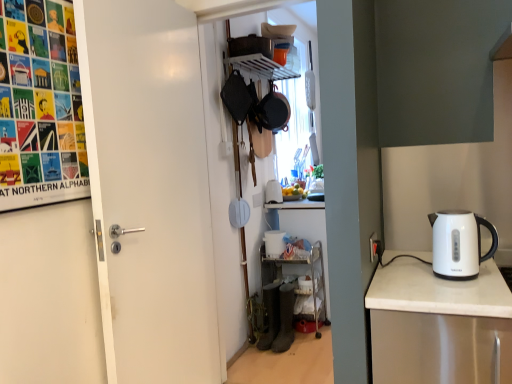
Question: Is white plastic shelf at upper center, marked as the second shelf in a bottom-to-top arrangement, at the left side of matte black frying pan at upper center?

Choices:
 (A) yes
 (B) no

Answer: (A)

Question: Considering the relative sizes of white plastic shelf at upper center, marked as the second shelf in a bottom-to-top arrangement, and matte black frying pan at upper center in the image provided, is white plastic shelf at upper center, marked as the second shelf in a bottom-to-top arrangement, shorter than matte black frying pan at upper center?

Choices:
 (A) yes
 (B) no

Answer: (A)

Question: Is the depth of white plastic shelf at upper center, the 1th shelf from the top, greater than that of matte black frying pan at upper center?

Choices:
 (A) no
 (B) yes

Answer: (A)

Question: Is white plastic shelf at upper center, marked as the second shelf in a bottom-to-top arrangement, smaller than matte black frying pan at upper center?

Choices:
 (A) no
 (B) yes

Answer: (B)

Question: Is white plastic shelf at upper center, the 1th shelf from the top, taller than matte black frying pan at upper center?

Choices:
 (A) yes
 (B) no

Answer: (B)

Question: Is white plastic shelf at upper center, marked as the second shelf in a bottom-to-top arrangement, thinner than matte black frying pan at upper center?

Choices:
 (A) yes
 (B) no

Answer: (B)

Question: Does multicolored paper poster at upper left have a smaller size compared to white matte door at left?

Choices:
 (A) no
 (B) yes

Answer: (B)

Question: Are multicolored paper poster at upper left and white matte door at left beside each other?

Choices:
 (A) yes
 (B) no

Answer: (B)

Question: From a real-world perspective, does multicolored paper poster at upper left stand above white matte door at left?

Choices:
 (A) yes
 (B) no

Answer: (A)

Question: Does multicolored paper poster at upper left have a lesser height compared to white matte door at left?

Choices:
 (A) yes
 (B) no

Answer: (A)

Question: Does multicolored paper poster at upper left lie in front of white matte door at left?

Choices:
 (A) no
 (B) yes

Answer: (B)

Question: Can you confirm if multicolored paper poster at upper left is thinner than white matte door at left?

Choices:
 (A) no
 (B) yes

Answer: (B)

Question: Is white matte door at left aimed at metallic silver shelf at lower center, the first shelf when ordered from bottom to top?

Choices:
 (A) no
 (B) yes

Answer: (A)